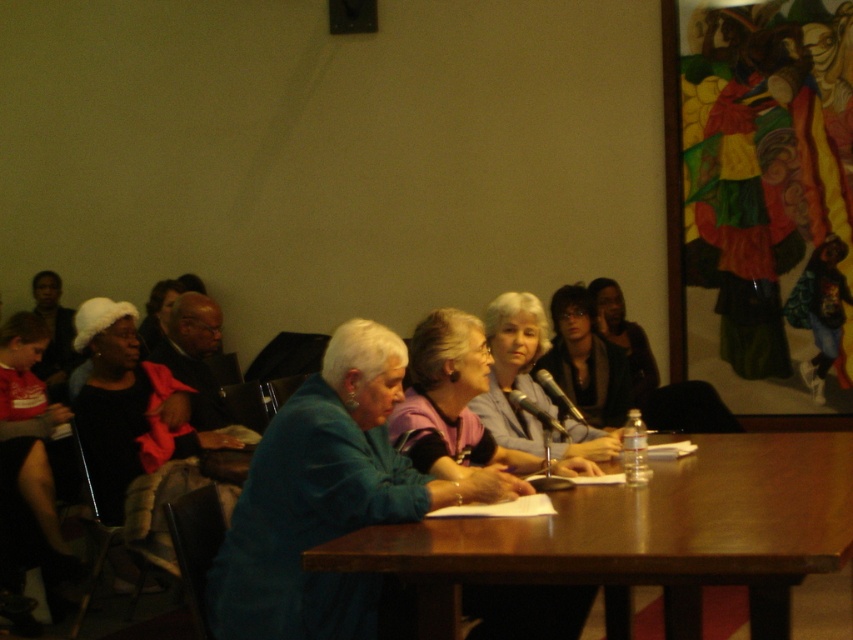
Can you confirm if brown wood table at center is positioned above blue fabric jacket at center?

Incorrect, brown wood table at center is not positioned above blue fabric jacket at center.

What do you see at coordinates (642, 536) in the screenshot? I see `brown wood table at center` at bounding box center [642, 536].

You are a GUI agent. You are given a task and a screenshot of the screen. Output one action in this format:
    pyautogui.click(x=<x>, y=<y>)
    Task: Click on the brown wood table at center
    This screenshot has height=640, width=853.
    Given the screenshot: What is the action you would take?
    click(x=642, y=536)

Is smooth gray sweater at center above matte black jacket at center?

No.

Between point (514, 365) and point (577, 372), which one is positioned in front?

Point (514, 365) is in front.

Does point (610, 436) come in front of point (590, 417)?

Yes, it is.

Find the location of a particular element. Image resolution: width=853 pixels, height=640 pixels. smooth gray sweater at center is located at coordinates (514, 371).

Is blue fabric jacket at center to the left of matte black jacket at center from the viewer's perspective?

Yes, blue fabric jacket at center is to the left of matte black jacket at center.

Can you confirm if blue fabric jacket at center is shorter than matte black jacket at center?

Yes.

Between point (438, 362) and point (616, 360), which one is positioned behind?

The point (616, 360) is behind.

The image size is (853, 640). Find the location of `blue fabric jacket at center`. blue fabric jacket at center is located at coordinates (450, 401).